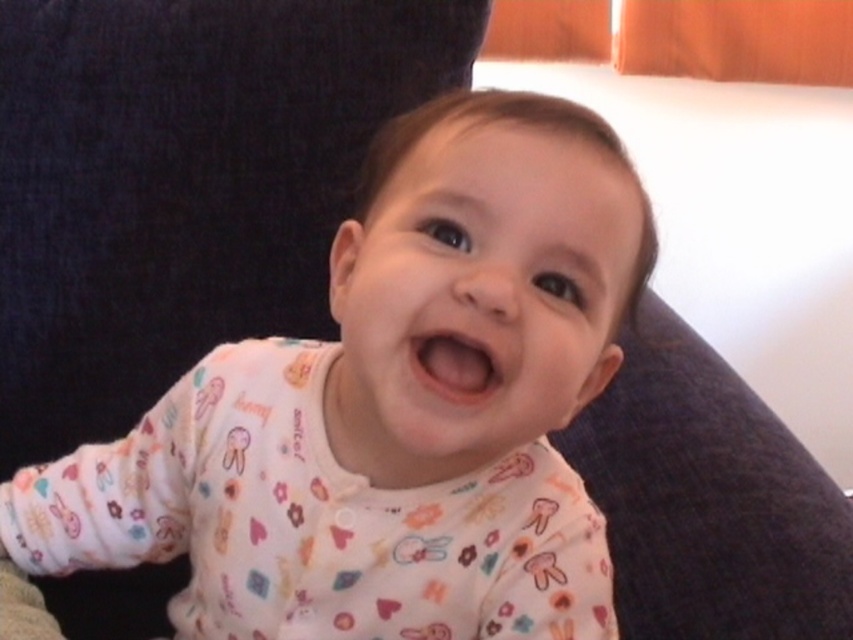
You are a photographer trying to capture the perfect shot of the baby in the scene. You need to focus on both the white soft fabric baby at center and the pink smooth mouth at center. Which object should you adjust your focus to first if you want to ensure the larger one is in sharp focus?

The white soft fabric baby at center is larger than the pink smooth mouth at center, so you should focus on the white soft fabric baby at center first to ensure it is in sharp focus.

You are a photographer trying to capture the baby in the image. You need to adjust your camera focus to ensure both the white soft fabric baby at center and the pink smooth mouth at center are clearly visible. Which object should you focus on first to ensure proper depth of field?

The white soft fabric baby at center is positioned under the pink smooth mouth at center, so focusing on the white soft fabric baby at center first will ensure both are in focus due to its closer proximity to the camera.

You are a photographer setting up a camera at position point 0.5, 0.5. You want to capture a closeup shot of the white soft fabric baby at center. Based on the coordinates provided, should you move your camera closer or further away to get a better focus?

The white soft fabric baby at center is located at point [389,410], which is slightly to the right and above the camera position at [426,320]. To focus better, you should move the camera closer to the baby by adjusting the position towards the right and upward direction.